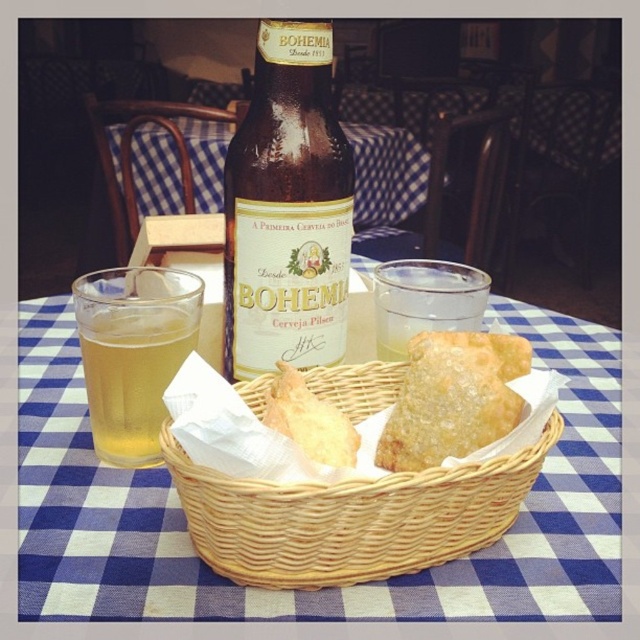
Who is lower down, brown glass bottle at center or translucent glass at left?

translucent glass at left is lower down.

Which is more to the left, brown glass bottle at center or translucent glass at left?

Positioned to the left is translucent glass at left.

This screenshot has height=640, width=640. What do you see at coordinates (288, 209) in the screenshot? I see `brown glass bottle at center` at bounding box center [288, 209].

This screenshot has width=640, height=640. What are the coordinates of `brown glass bottle at center` in the screenshot? It's located at tap(288, 209).

This screenshot has width=640, height=640. In order to click on woven basket at center in this screenshot , I will do `click(324, 588)`.

Locate an element on the screen. woven basket at center is located at coordinates (324, 588).

Where is `woven basket at center`? This screenshot has width=640, height=640. woven basket at center is located at coordinates (324, 588).

Between point (605, 563) and point (132, 436), which one is positioned behind?

The point (132, 436) is more distant.

Which is below, woven basket at center or translucent glass at left?

woven basket at center is below.

Describe the element at coordinates (324, 588) in the screenshot. I see `woven basket at center` at that location.

Locate an element on the screen. The width and height of the screenshot is (640, 640). woven basket at center is located at coordinates (324, 588).